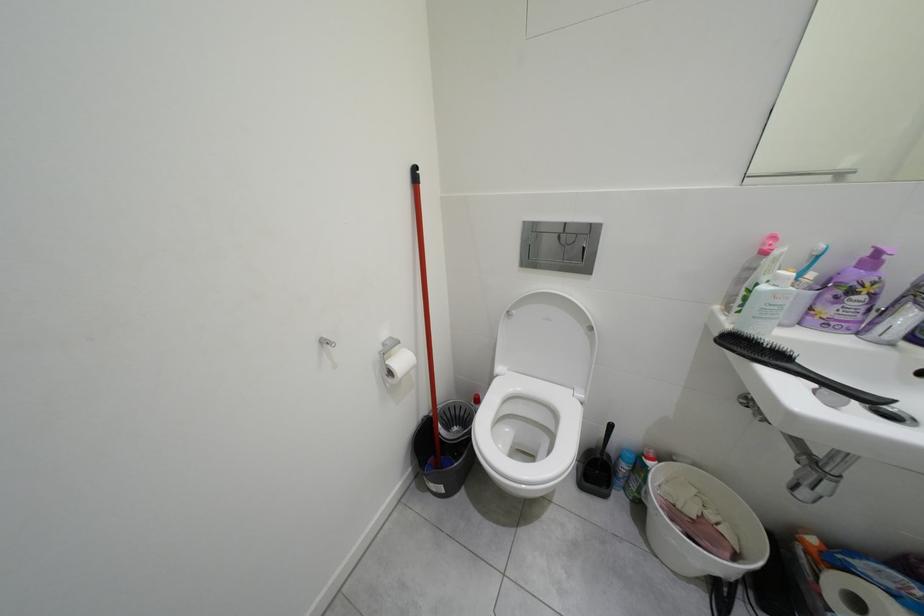
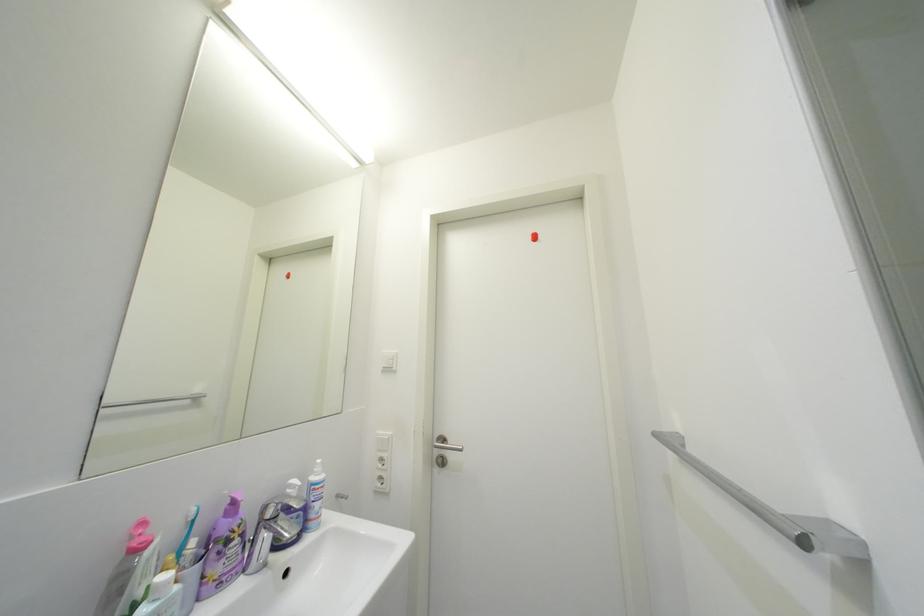
Question: The images are taken continuously from a first-person perspective. In which direction is your viewpoint rotating?

Choices:
 (A) Left
 (B) Right
 (C) Up
 (D) Down

Answer: (B)